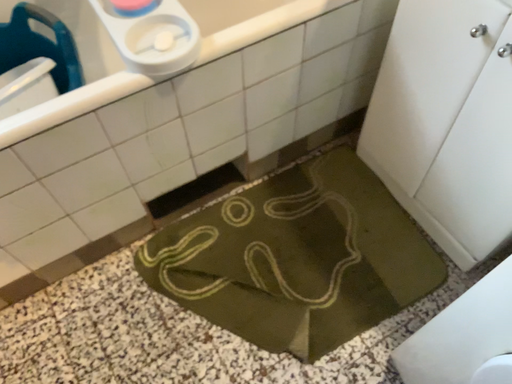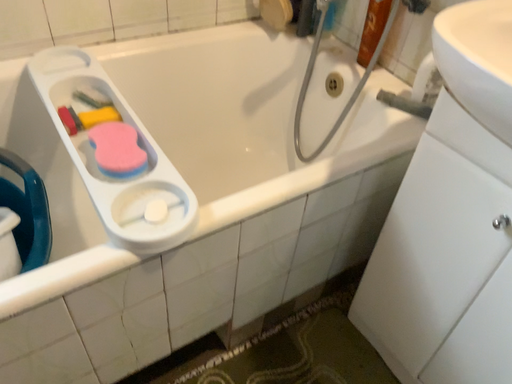
Question: How did the camera likely rotate when shooting the video?

Choices:
 (A) rotated upward
 (B) rotated downward

Answer: (A)